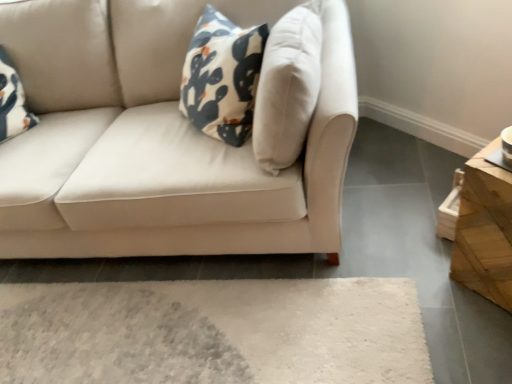
Question: Should I look upward or downward to see wooden side table at right?

Choices:
 (A) up
 (B) down

Answer: (B)